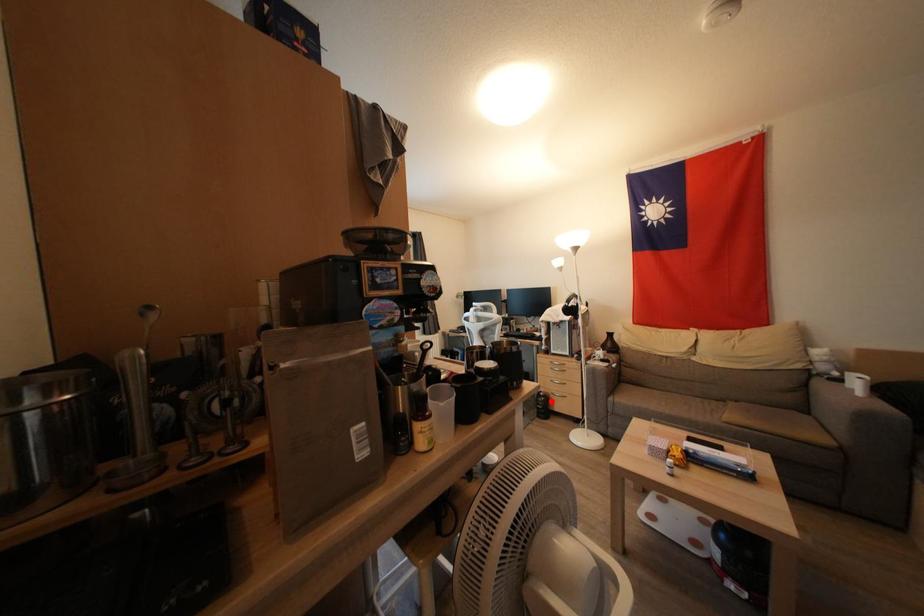
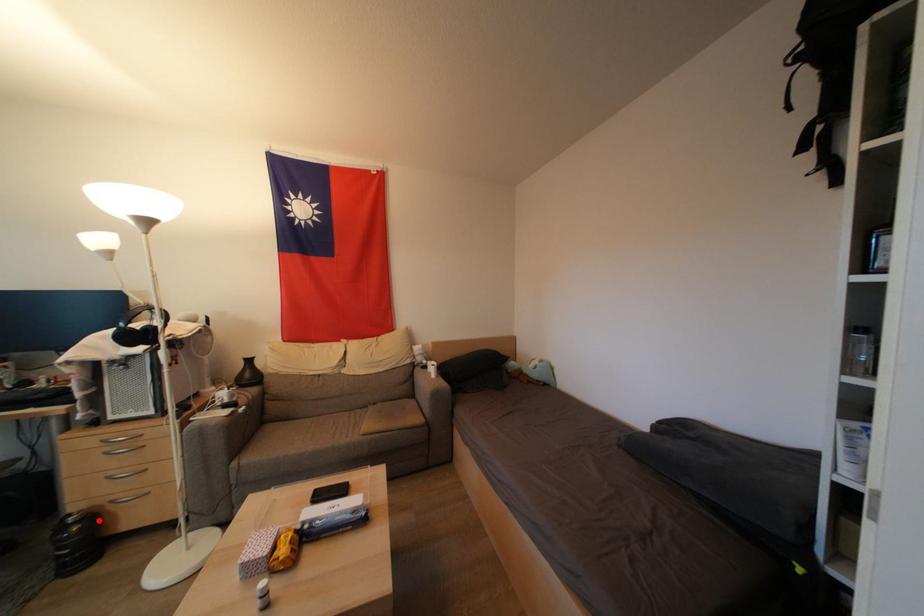
I am providing you with two images of the same scene from different viewpoints. A red point is marked on the first image and another point is marked on the second image. Does the point marked in image1 correspond to the same location as the one in image2?

Yes